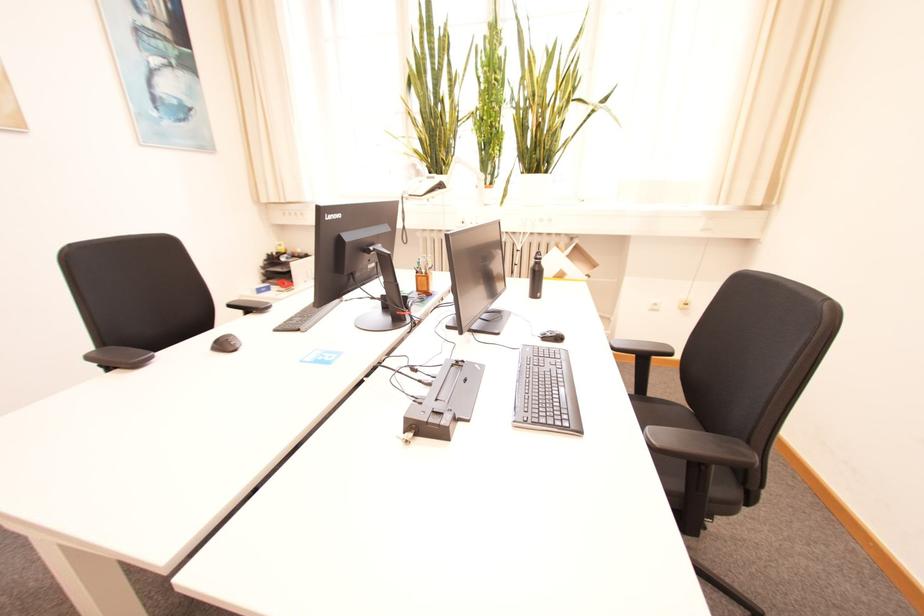
Describe the element at coordinates (545, 391) in the screenshot. The image size is (924, 616). I see `the black keyboard` at that location.